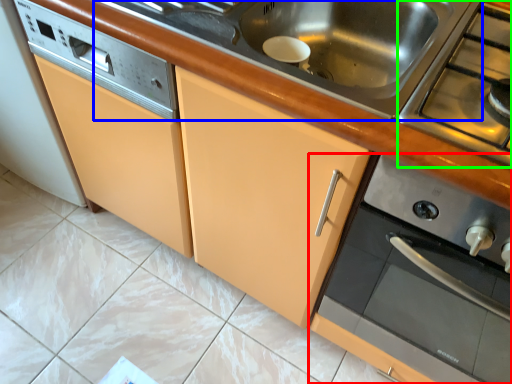
Question: Based on their relative distances, which object is farther from home appliance (highlighted by a red box)? Choose from sink (highlighted by a blue box) and gas stove (highlighted by a green box).

Choices:
 (A) sink
 (B) gas stove

Answer: (A)